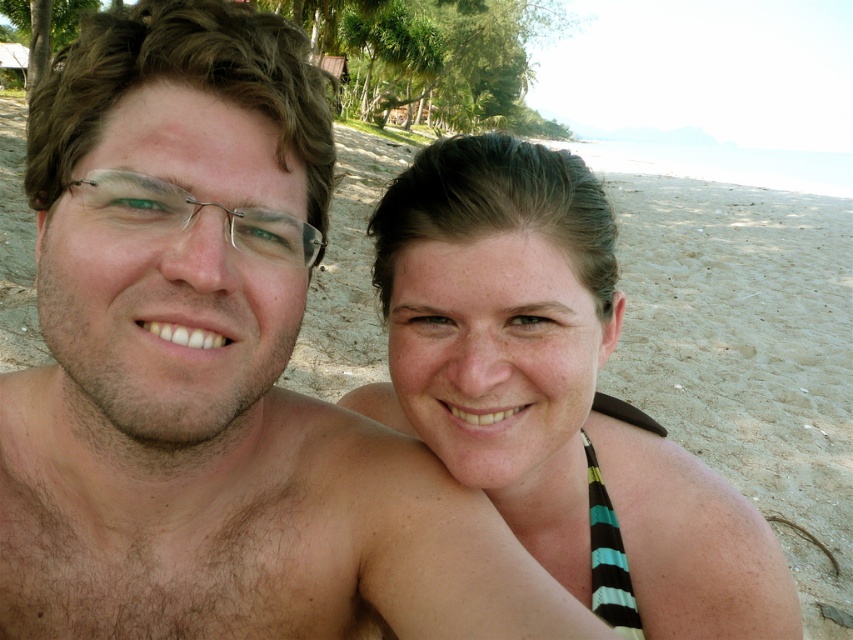
Question: Does matte black bikini top at center appear over metallic wire frame glasses at left?

Choices:
 (A) yes
 (B) no

Answer: (B)

Question: Which point is closer to the camera?

Choices:
 (A) (601, 264)
 (B) (271, 236)

Answer: (B)

Question: Which point is closer to the camera?

Choices:
 (A) matte black bikini top at center
 (B) metallic wire frame glasses at left

Answer: (B)

Question: Which point is farther to the camera?

Choices:
 (A) (556, 448)
 (B) (279, 221)

Answer: (A)

Question: Is matte black bikini top at center closer to the viewer compared to metallic wire frame glasses at left?

Choices:
 (A) no
 (B) yes

Answer: (A)

Question: Can you confirm if matte black bikini top at center is positioned to the right of metallic wire frame glasses at left?

Choices:
 (A) no
 (B) yes

Answer: (B)